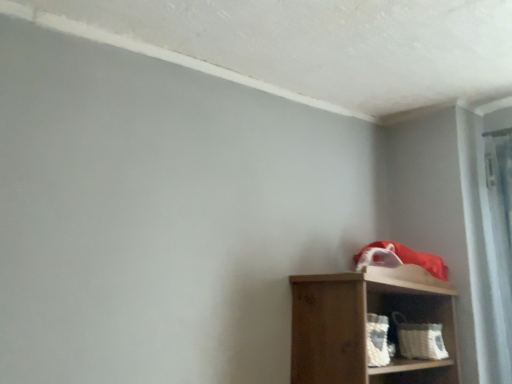
This screenshot has height=384, width=512. In order to click on white woven laundry basket at lower right in this screenshot , I will do coord(419,339).

The width and height of the screenshot is (512, 384). Describe the element at coordinates (419, 339) in the screenshot. I see `white woven laundry basket at lower right` at that location.

In order to click on white woven laundry basket at lower right in this screenshot , I will do `click(419, 339)`.